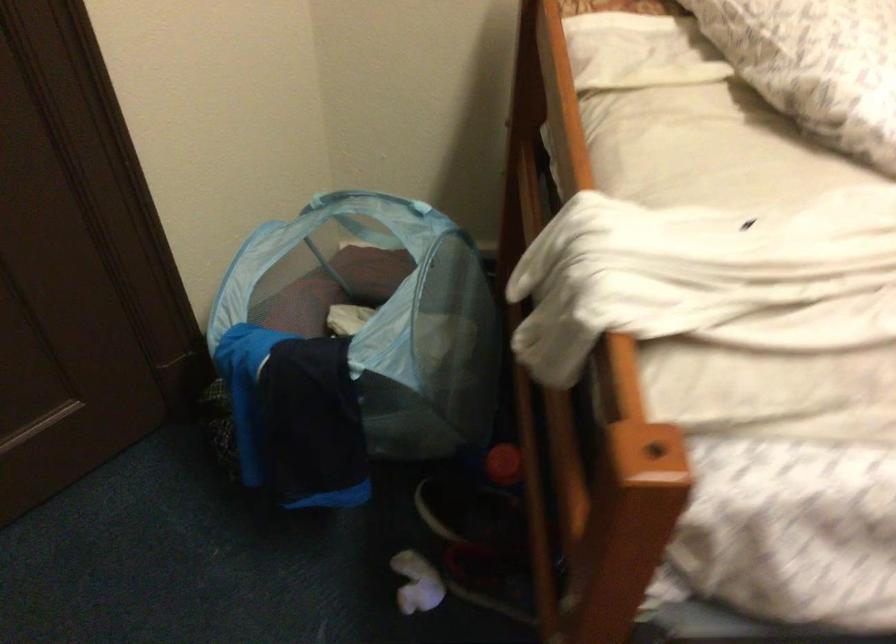
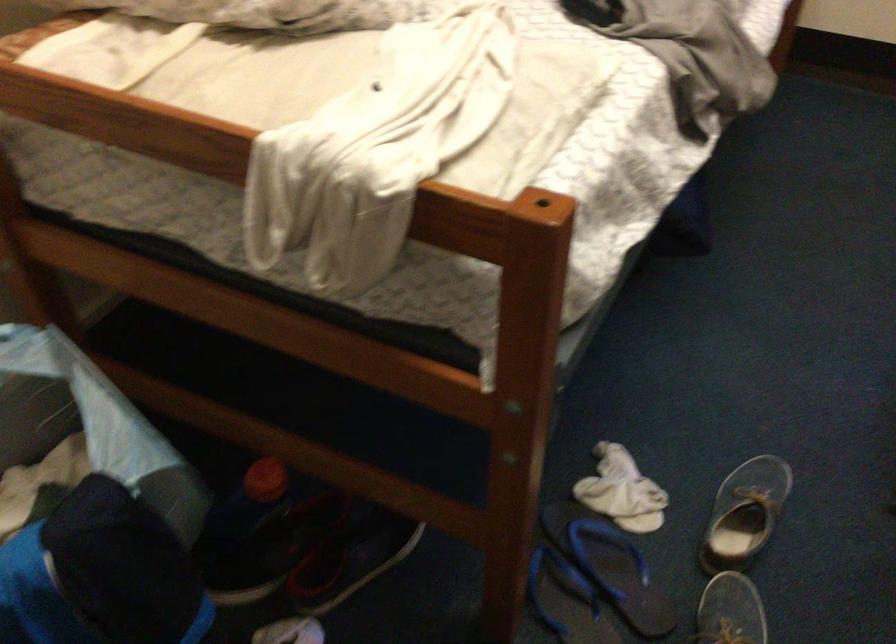
The point at (496, 466) is marked in the first image. Where is the corresponding point in the second image?

(264, 480)